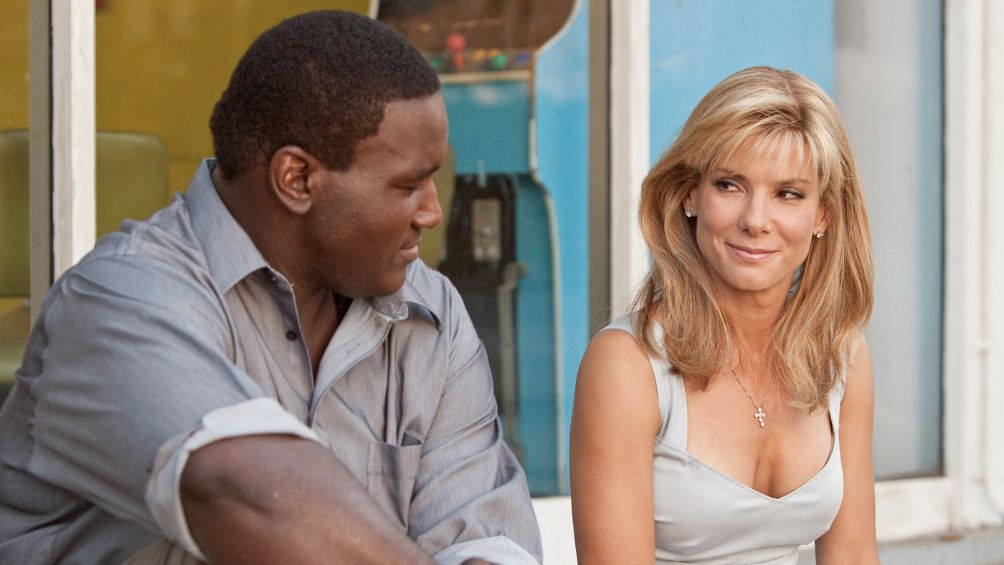
The height and width of the screenshot is (565, 1004). In order to click on window in this screenshot , I will do `click(902, 370)`.